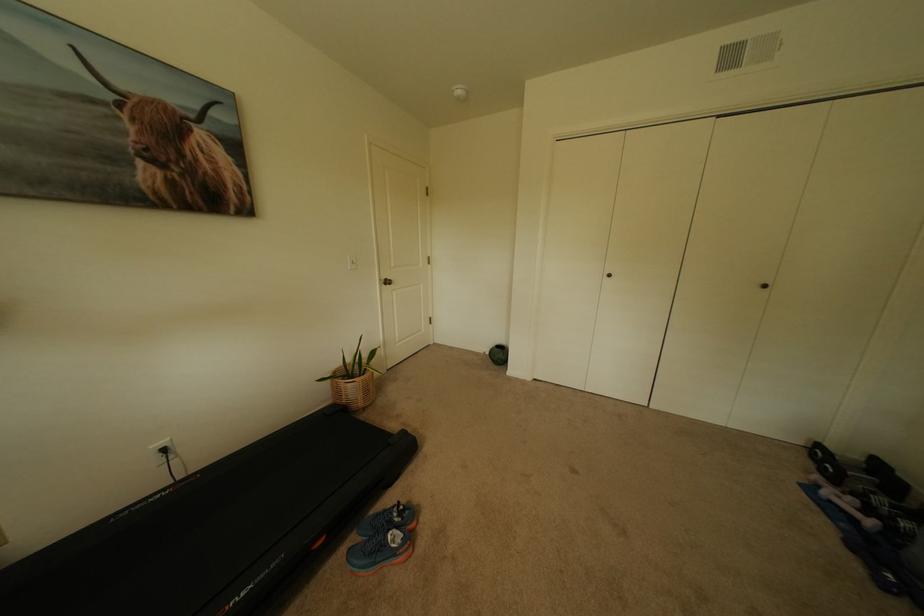
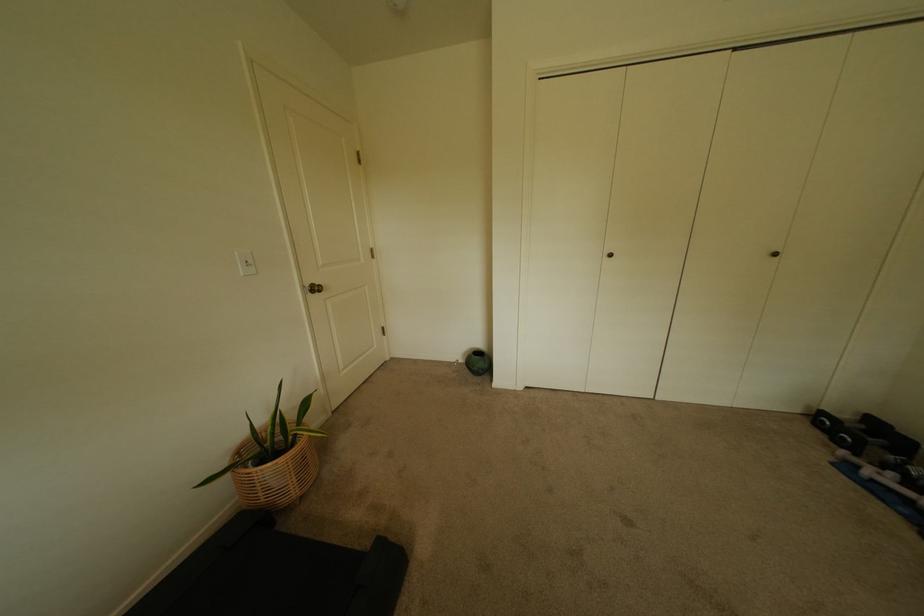
Locate, in the second image, the point that corresponds to the point at 773,286 in the first image.

(784, 256)